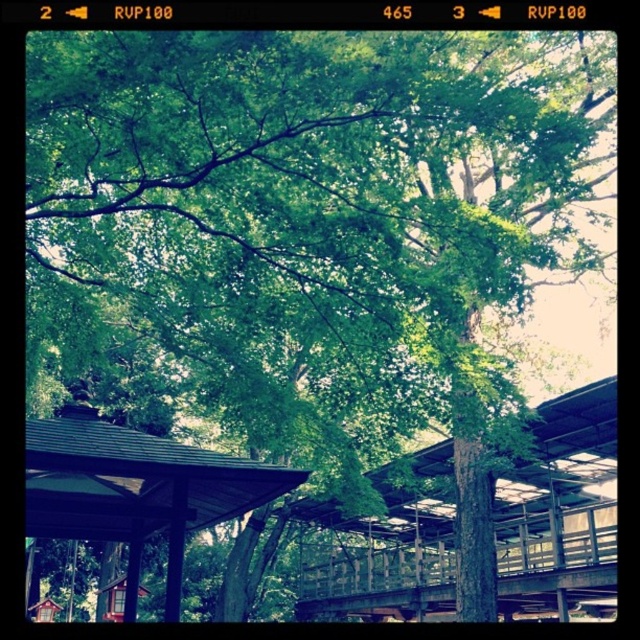
Question: Which object is farther from the camera taking this photo?

Choices:
 (A) metallic gray pavilion at center
 (B) brown wooden shelter at lower left

Answer: (B)

Question: Is metallic gray pavilion at center above brown wooden shelter at lower left?

Choices:
 (A) no
 (B) yes

Answer: (A)

Question: Is metallic gray pavilion at center further to the viewer compared to brown wooden shelter at lower left?

Choices:
 (A) no
 (B) yes

Answer: (A)

Question: Does metallic gray pavilion at center appear under brown wooden shelter at lower left?

Choices:
 (A) yes
 (B) no

Answer: (A)

Question: Which of the following is the closest to the observer?

Choices:
 (A) (134, 609)
 (B) (387, 472)

Answer: (A)